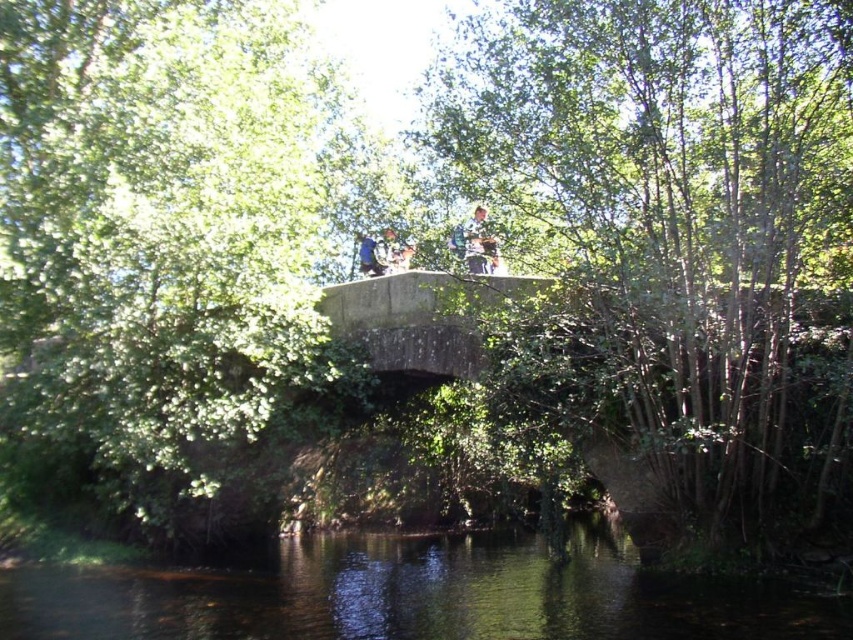
Question: Is camouflage fabric person at center wider than blue fabric person at center?

Choices:
 (A) yes
 (B) no

Answer: (B)

Question: Does dark green water at center appear over camouflage fabric person at center?

Choices:
 (A) yes
 (B) no

Answer: (B)

Question: Which is farther from the blue fabric person at center?

Choices:
 (A) camouflage fabric person at center
 (B) dark green water at center

Answer: (B)

Question: Which point is closer to the camera?

Choices:
 (A) dark green water at center
 (B) blue fabric person at center

Answer: (A)

Question: Does camouflage fabric person at center have a lesser width compared to blue fabric person at center?

Choices:
 (A) no
 (B) yes

Answer: (B)

Question: Which object appears farthest from the camera in this image?

Choices:
 (A) camouflage fabric person at center
 (B) dark green water at center
 (C) blue fabric person at center

Answer: (C)